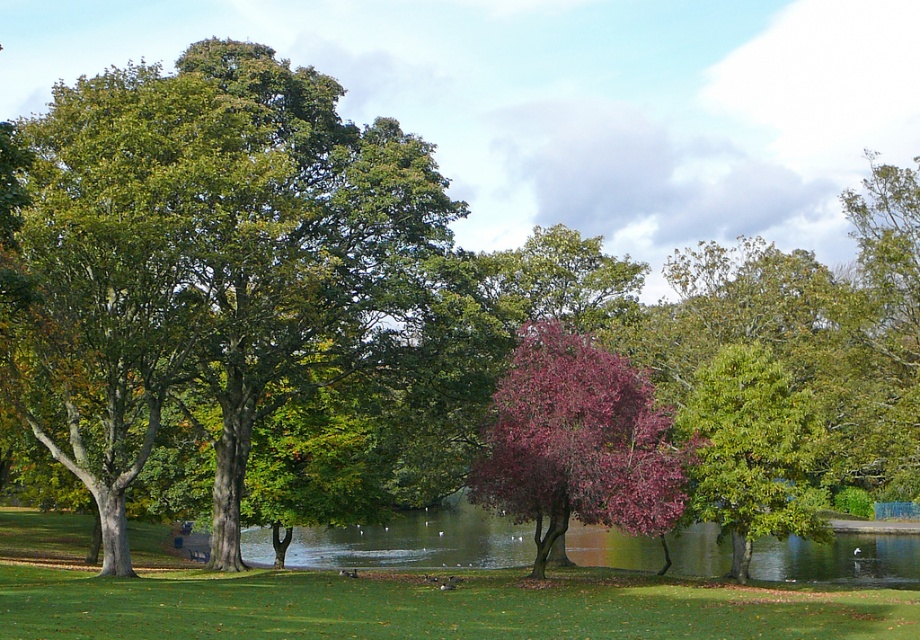
Does purple glossy tree at center appear over green glossy tree at right?

Yes, purple glossy tree at center is above green glossy tree at right.

Where is `purple glossy tree at center`? purple glossy tree at center is located at coordinates (577, 444).

Can you confirm if green leafy tree at left is positioned to the right of purple glossy tree at center?

In fact, green leafy tree at left is to the left of purple glossy tree at center.

Locate an element on the screen. green leafy tree at left is located at coordinates (210, 262).

Can you confirm if purple glossy tree at center is positioned above green grassy lake at center?

Correct, purple glossy tree at center is located above green grassy lake at center.

Does purple glossy tree at center have a larger size compared to green grassy lake at center?

No, purple glossy tree at center is not bigger than green grassy lake at center.

Does point (654, 525) come closer to viewer compared to point (435, 541)?

Yes, it is in front of point (435, 541).

Image resolution: width=920 pixels, height=640 pixels. In order to click on purple glossy tree at center in this screenshot , I will do `click(577, 444)`.